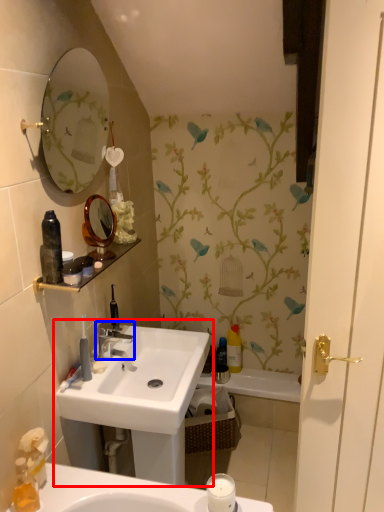
Question: Which object is further to the camera taking this photo, sink (highlighted by a red box) or tap (highlighted by a blue box)?

Choices:
 (A) sink
 (B) tap

Answer: (B)